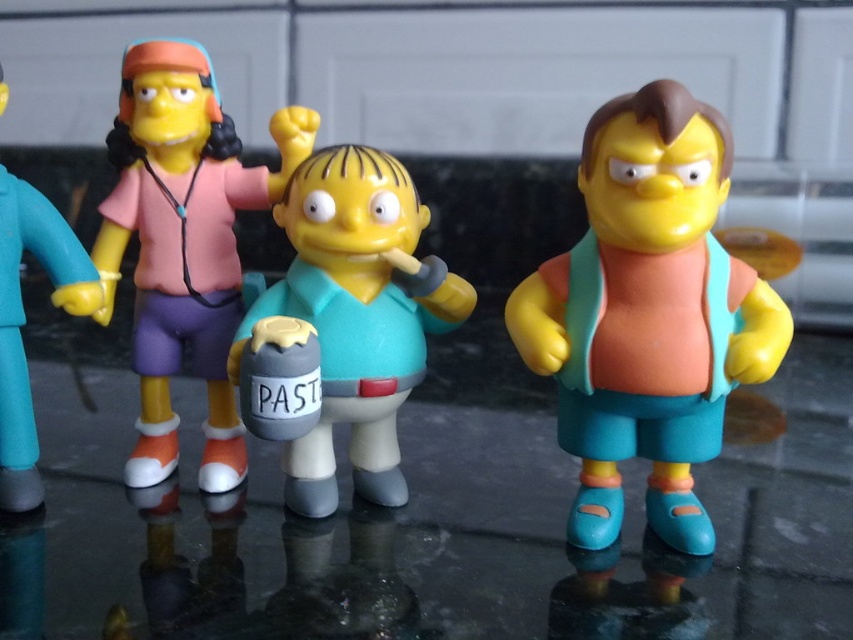
You are standing in front of the four toy figurines from The Simpsons. There are two points marked on the image at coordinates point (598,298) and point (280,397). Which point is closer to you?

Point (598,298) is further to the camera than point (280,397), so the point closer to you is point (280,397).